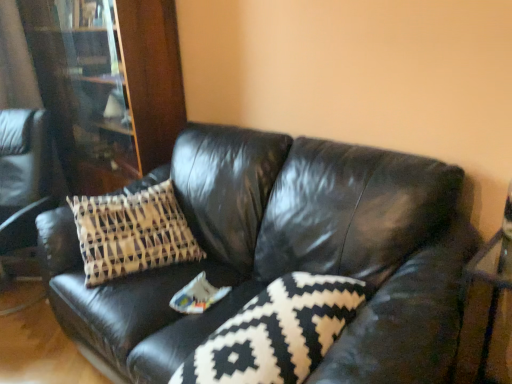
Question: From the image's perspective, would you say wooden bookcase at left is positioned over black leather couch at center?

Choices:
 (A) no
 (B) yes

Answer: (B)

Question: Is wooden bookcase at left far from black leather couch at center?

Choices:
 (A) no
 (B) yes

Answer: (A)

Question: Can you confirm if wooden bookcase at left is thinner than black leather couch at center?

Choices:
 (A) yes
 (B) no

Answer: (A)

Question: Can you confirm if wooden bookcase at left is shorter than black leather couch at center?

Choices:
 (A) yes
 (B) no

Answer: (B)

Question: Can black leather couch at center be found inside wooden bookcase at left?

Choices:
 (A) no
 (B) yes

Answer: (A)

Question: Considering the relative positions of black and white patterned pillow at center and wooden bookcase at left in the image provided, is black and white patterned pillow at center to the left or to the right of wooden bookcase at left?

Choices:
 (A) left
 (B) right

Answer: (B)

Question: In terms of width, does black and white patterned pillow at center look wider or thinner when compared to wooden bookcase at left?

Choices:
 (A) wide
 (B) thin

Answer: (A)

Question: In the image, is black and white patterned pillow at center positioned in front of or behind wooden bookcase at left?

Choices:
 (A) front
 (B) behind

Answer: (A)

Question: Is point (287, 369) closer or farther from the camera than point (125, 79)?

Choices:
 (A) closer
 (B) farther

Answer: (A)

Question: Visually, is black leather couch at center positioned to the left or to the right of black and white patterned pillow at center?

Choices:
 (A) right
 (B) left

Answer: (B)

Question: Is black leather couch at center wider or thinner than black and white patterned pillow at center?

Choices:
 (A) thin
 (B) wide

Answer: (B)

Question: Looking at the image, does black leather couch at center seem bigger or smaller compared to black and white patterned pillow at center?

Choices:
 (A) big
 (B) small

Answer: (A)

Question: From the image's perspective, relative to black and white patterned pillow at center, is black leather couch at center above or below?

Choices:
 (A) above
 (B) below

Answer: (A)

Question: Considering the positions of wooden bookcase at left and black and white patterned pillow at center in the image, is wooden bookcase at left wider or thinner than black and white patterned pillow at center?

Choices:
 (A) thin
 (B) wide

Answer: (A)

Question: From the image's perspective, is wooden bookcase at left positioned above or below black and white patterned pillow at center?

Choices:
 (A) below
 (B) above

Answer: (B)